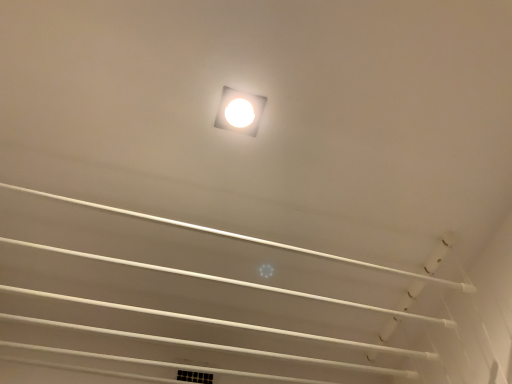
This screenshot has height=384, width=512. Describe the element at coordinates (239, 111) in the screenshot. I see `white glossy light fixture at upper center` at that location.

In order to click on white glossy light fixture at upper center in this screenshot , I will do `click(239, 111)`.

Measure the distance between white glossy light fixture at upper center and camera.

white glossy light fixture at upper center and camera are 33.15 inches apart.

This screenshot has width=512, height=384. In order to click on white glossy light fixture at upper center in this screenshot , I will do `click(239, 111)`.